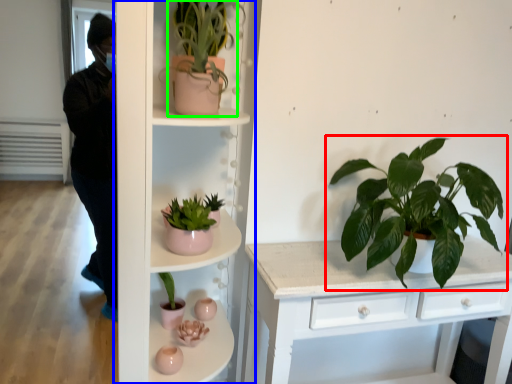
Question: Based on their relative distances, which object is nearer to houseplant (highlighted by a red box)? Choose from shelf (highlighted by a blue box) and houseplant (highlighted by a green box).

Choices:
 (A) shelf
 (B) houseplant

Answer: (A)